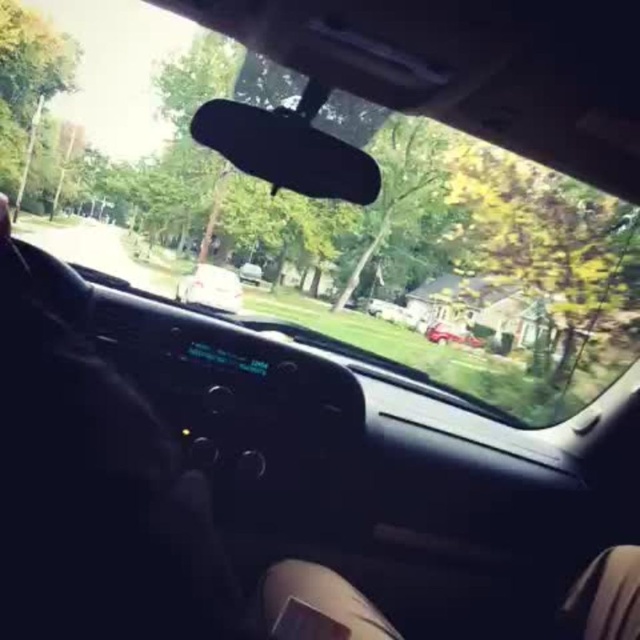
You are driving a car and need to park in a narrow space between the white glossy sedan at center and the metallic silver car at center. The space is exactly 2 meters wide. Can your car, which is 1.8 meters wide, fit into the space?

The white glossy sedan at center is wider than the metallic silver car at center. Since the space between them is 2 meters wide and your car is 1.8 meters wide, your car can fit into the space as there is enough width available.

You are a delivery robot with a height of 1.5 meters. You are standing inside a car and looking through the transparent glass car window at center. Can you see the top of the white car parked outside without tilting your head?

The transparent glass car window at center is 1.43 meters away from you. Since your height is 1.5 meters and the window is only 1.43 meters away, you might be able to see the top of the white car parked outside without tilting your head, as your height slightly exceeds the distance to the window, allowing for a slight upward view.

Consider the image. You are driving a car and want to safely open the transparent glass car window at center to let some fresh air in. Considering the proximity of the white glossy sedan at center, is there enough space to do so without hitting the other car?

The distance between the transparent glass car window at center and the white glossy sedan at center is 2.89 meters. Since opening a standard car window typically requires less than this distance, there should be sufficient space to open the window safely without hitting the other vehicle.